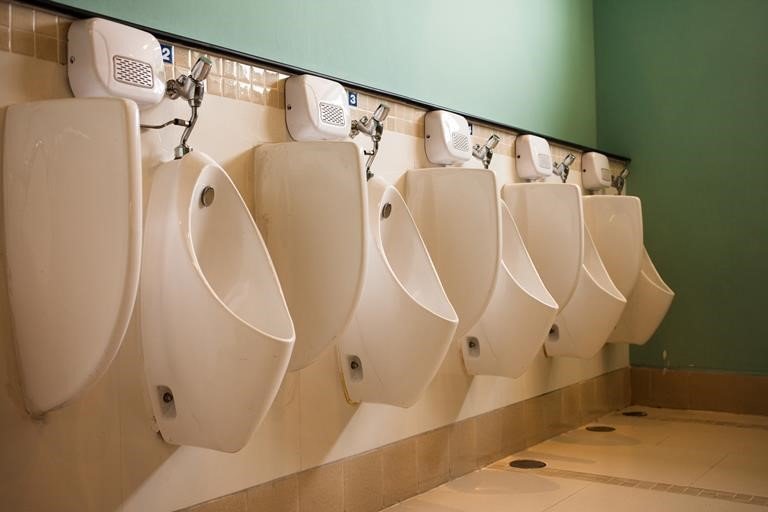
Locate an element on the screen. The height and width of the screenshot is (512, 768). urinals is located at coordinates (213, 294), (402, 330), (540, 317), (591, 324), (653, 323).